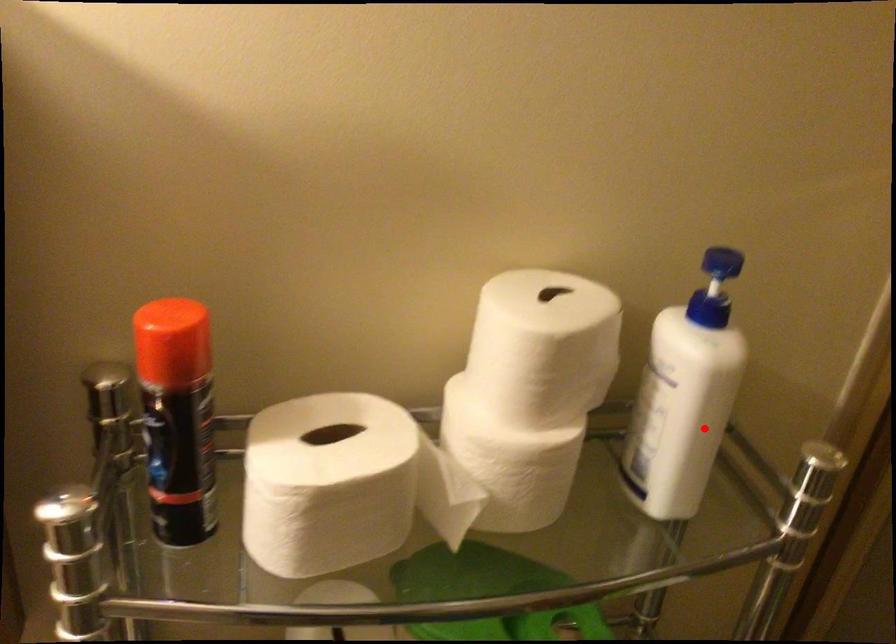
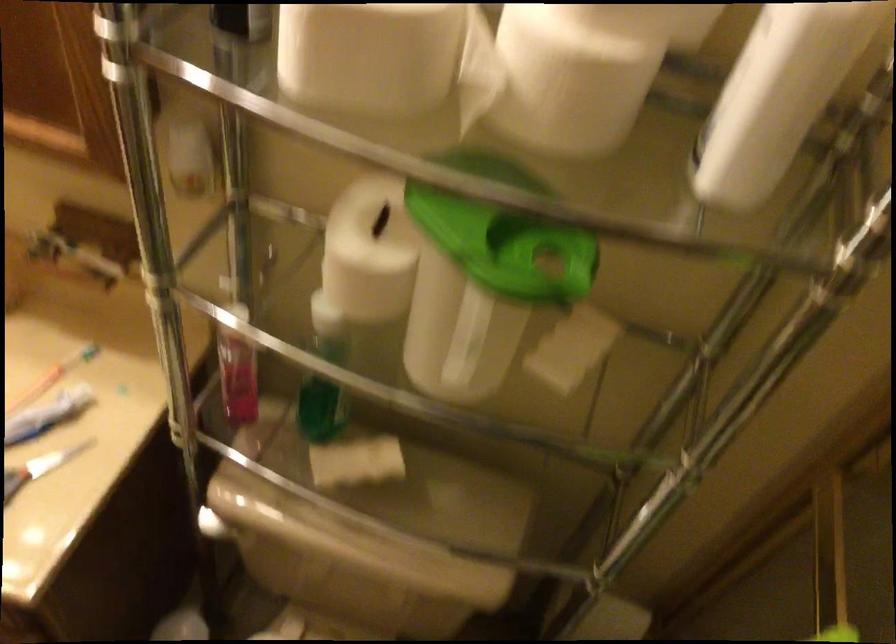
The point at the highlighted location is marked in the first image. Where is the corresponding point in the second image?

(778, 96)